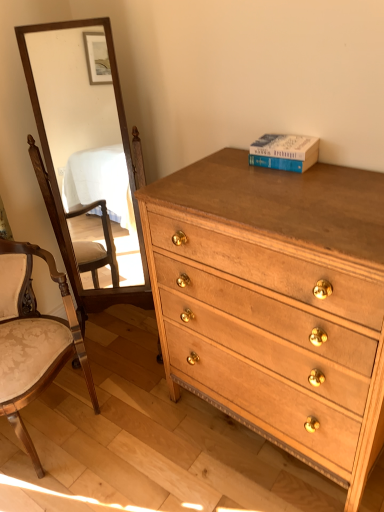
Question: From a real-world perspective, is wooden upholstered chair at left located beneath blue hardcover book at upper right?

Choices:
 (A) yes
 (B) no

Answer: (A)

Question: Is wooden upholstered chair at left thinner than blue hardcover book at upper right?

Choices:
 (A) yes
 (B) no

Answer: (B)

Question: Is wooden upholstered chair at left at the left side of blue hardcover book at upper right?

Choices:
 (A) no
 (B) yes

Answer: (B)

Question: Can you confirm if wooden upholstered chair at left is taller than blue hardcover book at upper right?

Choices:
 (A) yes
 (B) no

Answer: (A)

Question: Is wooden upholstered chair at left shorter than blue hardcover book at upper right?

Choices:
 (A) yes
 (B) no

Answer: (B)

Question: Is blue hardcover book at upper right taller or shorter than light brown wood chest of drawers at center?

Choices:
 (A) tall
 (B) short

Answer: (B)

Question: Is point (284, 163) positioned closer to the camera than point (163, 286)?

Choices:
 (A) closer
 (B) farther

Answer: (A)

Question: Looking at their shapes, would you say blue hardcover book at upper right is wider or thinner than light brown wood chest of drawers at center?

Choices:
 (A) thin
 (B) wide

Answer: (A)

Question: From a real-world perspective, is blue hardcover book at upper right positioned above or below light brown wood chest of drawers at center?

Choices:
 (A) below
 (B) above

Answer: (B)

Question: Is wooden upholstered chair at left situated inside light brown wood chest of drawers at center or outside?

Choices:
 (A) inside
 (B) outside

Answer: (B)

Question: Considering the positions of wooden upholstered chair at left and light brown wood chest of drawers at center in the image, is wooden upholstered chair at left taller or shorter than light brown wood chest of drawers at center?

Choices:
 (A) tall
 (B) short

Answer: (B)

Question: In terms of size, does wooden upholstered chair at left appear bigger or smaller than light brown wood chest of drawers at center?

Choices:
 (A) small
 (B) big

Answer: (A)

Question: In terms of width, does wooden upholstered chair at left look wider or thinner when compared to light brown wood chest of drawers at center?

Choices:
 (A) wide
 (B) thin

Answer: (A)

Question: Is light brown wood chest of drawers at center spatially inside blue hardcover book at upper right, or outside of it?

Choices:
 (A) inside
 (B) outside

Answer: (B)

Question: Is light brown wood chest of drawers at center in front of or behind blue hardcover book at upper right in the image?

Choices:
 (A) front
 (B) behind

Answer: (A)